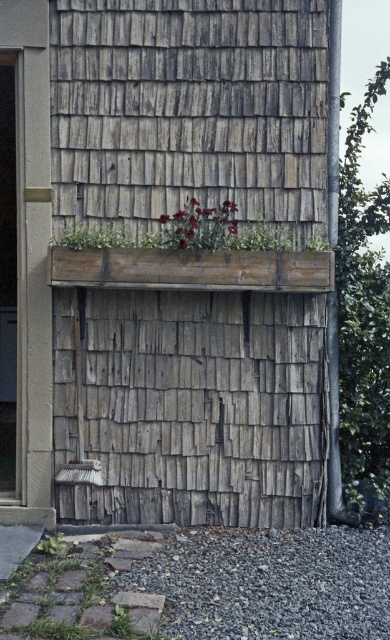
Can you confirm if green leafy plant at right is smaller than deep red petals at center?

Actually, green leafy plant at right might be larger than deep red petals at center.

Is green leafy plant at right wider than deep red petals at center?

In fact, green leafy plant at right might be narrower than deep red petals at center.

Measure the distance between point (358, 237) and camera.

Point (358, 237) is 29.17 feet away from camera.

The image size is (390, 640). Find the location of `green leafy plant at right`. green leafy plant at right is located at coordinates (x=363, y=314).

Does green leafy plant at right appear on the left side of green matte planter at center?

Incorrect, green leafy plant at right is not on the left side of green matte planter at center.

Identify the location of green leafy plant at right. This screenshot has width=390, height=640. (363, 314).

Is point (354, 468) closer to camera compared to point (101, 237)?

No, (354, 468) is behind (101, 237).

Locate an element on the screen. The width and height of the screenshot is (390, 640). green leafy plant at right is located at coordinates (363, 314).

What do you see at coordinates (170, 260) in the screenshot?
I see `weathered wood hut at center` at bounding box center [170, 260].

Where is `weathered wood hut at center`? weathered wood hut at center is located at coordinates (170, 260).

Which is in front, point (342, 509) or point (120, 246)?

Point (120, 246)

Where is `weathered wood hut at center`? The height and width of the screenshot is (640, 390). weathered wood hut at center is located at coordinates coord(170,260).